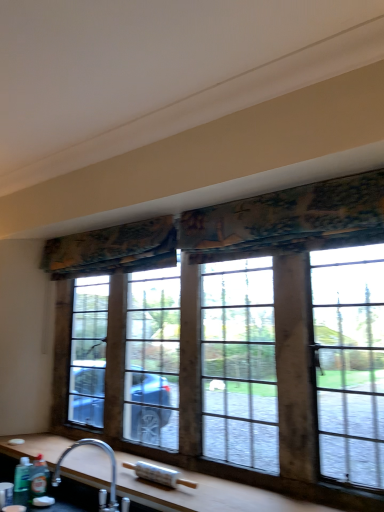
This screenshot has height=512, width=384. Describe the element at coordinates (22, 482) in the screenshot. I see `translucent plastic bottle at lower left, the first bottle viewed from the left` at that location.

In order to face green matte bottle at lower left, the second bottle from the left, should I rotate leftwards or rightwards?

Turn left by 19.917 degrees to look at green matte bottle at lower left, the second bottle from the left.

The height and width of the screenshot is (512, 384). What do you see at coordinates (113, 249) in the screenshot? I see `textured fabric curtain at upper center, arranged as the first curtain when viewed from the left` at bounding box center [113, 249].

This screenshot has height=512, width=384. I want to click on textured floral fabric at upper center, placed as the second curtain when sorted from back to front, so click(231, 229).

Find the location of `wooden at lower center`. wooden at lower center is located at coordinates (205, 494).

The height and width of the screenshot is (512, 384). Identify the location of wooden-framed window at center. (242, 240).

I want to click on translucent plastic bottle at lower left, the first bottle viewed from the left, so pos(22,482).

Between translucent plastic bottle at lower left, marked as the 2th bottle in a right-to-left arrangement, and wooden-framed window at center, which one has smaller size?

Smaller between the two is translucent plastic bottle at lower left, marked as the 2th bottle in a right-to-left arrangement.

Is translucent plastic bottle at lower left, the first bottle viewed from the left, to the left of wooden-framed window at center from the viewer's perspective?

Yes.

In the scene shown: Which is correct: translucent plastic bottle at lower left, the first bottle viewed from the left, is inside wooden-framed window at center, or outside of it?

translucent plastic bottle at lower left, the first bottle viewed from the left, cannot be found inside wooden-framed window at center.

How many degrees apart are the facing directions of translucent plastic bottle at lower left, the first bottle viewed from the left, and wooden-framed window at center?

They differ by 1.12 degrees in their facing directions.

From the image's perspective, is textured fabric curtain at upper center, the first curtain when ordered from back to front, located beneath textured floral fabric at upper center, placed as the second curtain when sorted from left to right?

Yes.

Is textured floral fabric at upper center, placed as the first curtain when sorted from front to back, a part of textured fabric curtain at upper center, which appears as the second curtain when viewed from the right?

Definitely not — textured floral fabric at upper center, placed as the first curtain when sorted from front to back, is not inside textured fabric curtain at upper center, which appears as the second curtain when viewed from the right.

Could you measure the distance between textured fabric curtain at upper center, positioned as the 2th curtain in front-to-back order, and textured floral fabric at upper center, placed as the second curtain when sorted from back to front?

textured fabric curtain at upper center, positioned as the 2th curtain in front-to-back order, is 16.40 centimeters away from textured floral fabric at upper center, placed as the second curtain when sorted from back to front.

Between textured fabric curtain at upper center, the first curtain when ordered from back to front, and textured floral fabric at upper center, placed as the second curtain when sorted from left to right, which one appears on the left side from the viewer's perspective?

From the viewer's perspective, textured fabric curtain at upper center, the first curtain when ordered from back to front, appears more on the left side.

Is textured floral fabric at upper center, placed as the second curtain when sorted from back to front, completely or partially outside of translucent plastic bottle at lower left, the first bottle viewed from the left?

textured floral fabric at upper center, placed as the second curtain when sorted from back to front, is positioned outside translucent plastic bottle at lower left, the first bottle viewed from the left.

From a real-world perspective, which is physically below, textured floral fabric at upper center, placed as the first curtain when sorted from front to back, or translucent plastic bottle at lower left, marked as the 2th bottle in a right-to-left arrangement?

translucent plastic bottle at lower left, marked as the 2th bottle in a right-to-left arrangement, from a real-world perspective.

From the picture: How far apart are translucent plastic bottle at lower left, the first bottle viewed from the left, and wooden at lower center?

A distance of 15.70 inches exists between translucent plastic bottle at lower left, the first bottle viewed from the left, and wooden at lower center.

In terms of size, does translucent plastic bottle at lower left, marked as the 2th bottle in a right-to-left arrangement, appear bigger or smaller than wooden at lower center?

translucent plastic bottle at lower left, marked as the 2th bottle in a right-to-left arrangement, is smaller than wooden at lower center.

Could you tell me if translucent plastic bottle at lower left, marked as the 2th bottle in a right-to-left arrangement, is facing wooden at lower center?

No.

Considering the points (26, 460) and (89, 449), which point is behind, point (26, 460) or point (89, 449)?

The point (89, 449) is farther from the camera.

Between textured floral fabric at upper center, the first curtain positioned from the right, and wooden-framed window at center, which one appears on the left side from the viewer's perspective?

From the viewer's perspective, wooden-framed window at center appears more on the left side.

Does textured floral fabric at upper center, placed as the second curtain when sorted from back to front, have a greater width compared to wooden-framed window at center?

Yes.

From the image's perspective, which one is positioned higher, textured floral fabric at upper center, placed as the second curtain when sorted from back to front, or wooden-framed window at center?

textured floral fabric at upper center, placed as the second curtain when sorted from back to front, is shown above in the image.

Between textured floral fabric at upper center, placed as the first curtain when sorted from front to back, and wooden-framed window at center, which one has larger size?

Bigger between the two is wooden-framed window at center.

From the textured fabric curtain at upper center, the first curtain when ordered from back to front, count the 1st bottle to the left and point to it. Please provide its 2D coordinates.

[(38, 478)]

Considering the relative positions of green matte bottle at lower left, the second bottle from the left, and textured fabric curtain at upper center, which appears as the second curtain when viewed from the right, in the image provided, is green matte bottle at lower left, the second bottle from the left, behind textured fabric curtain at upper center, which appears as the second curtain when viewed from the right,?

No, green matte bottle at lower left, the second bottle from the left, is closer to the camera.

From a real-world perspective, is green matte bottle at lower left, the 1th bottle positioned from the right, under textured fabric curtain at upper center, arranged as the first curtain when viewed from the left?

Yes, from a real-world perspective, green matte bottle at lower left, the 1th bottle positioned from the right, is under textured fabric curtain at upper center, arranged as the first curtain when viewed from the left.

Is wooden-framed window at center oriented away from textured fabric curtain at upper center, arranged as the first curtain when viewed from the left?

Correct, wooden-framed window at center is looking away from textured fabric curtain at upper center, arranged as the first curtain when viewed from the left.

Consider the image. Is wooden-framed window at center completely or partially outside of textured fabric curtain at upper center, the first curtain when ordered from back to front?

Yes, wooden-framed window at center is not within textured fabric curtain at upper center, the first curtain when ordered from back to front.

Would you say wooden-framed window at center is to the left or to the right of textured fabric curtain at upper center, the first curtain when ordered from back to front, in the picture?

In the image, wooden-framed window at center appears on the right side of textured fabric curtain at upper center, the first curtain when ordered from back to front.

From a real-world perspective, is wooden-framed window at center positioned above or below textured fabric curtain at upper center, the first curtain when ordered from back to front?

wooden-framed window at center is situated lower than textured fabric curtain at upper center, the first curtain when ordered from back to front, in the real world.

I want to click on window lying above the translucent plastic bottle at lower left, the first bottle viewed from the left (from the image's perspective), so click(242, 240).

You are a GUI agent. You are given a task and a screenshot of the screen. Output one action in this format:
    pyautogui.click(x=<x>, y=<y>)
    Task: Click on the curtain in front of the textured fabric curtain at upper center, positioned as the 2th curtain in front-to-back order
    Image resolution: width=384 pixels, height=512 pixels.
    Given the screenshot: What is the action you would take?
    pyautogui.click(x=231, y=229)

From the image, which object appears to be farther from wooden-framed window at center, textured floral fabric at upper center, placed as the first curtain when sorted from front to back, or silver metallic faucet at lower left?

Among the two, silver metallic faucet at lower left is located further to wooden-framed window at center.

When comparing their distances from textured fabric curtain at upper center, which appears as the second curtain when viewed from the right, does translucent plastic bottle at lower left, the first bottle viewed from the left, or wooden-framed window at center seem further?

translucent plastic bottle at lower left, the first bottle viewed from the left, is further to textured fabric curtain at upper center, which appears as the second curtain when viewed from the right.

Based on their spatial positions, is translucent plastic bottle at lower left, the first bottle viewed from the left, or wooden at lower center further from wooden-framed window at center?

The object further to wooden-framed window at center is translucent plastic bottle at lower left, the first bottle viewed from the left.

Which object lies further to the anchor point silver metallic faucet at lower left, wooden at lower center or wooden-framed window at center?

wooden-framed window at center.

When comparing their distances from wooden at lower center, does silver metallic faucet at lower left or green matte bottle at lower left, the second bottle from the left, seem closer?

silver metallic faucet at lower left.

Estimate the real-world distances between objects in this image. Which object is further from translucent plastic bottle at lower left, marked as the 2th bottle in a right-to-left arrangement, green matte bottle at lower left, the 1th bottle positioned from the right, or textured fabric curtain at upper center, arranged as the first curtain when viewed from the left?

textured fabric curtain at upper center, arranged as the first curtain when viewed from the left, lies further to translucent plastic bottle at lower left, marked as the 2th bottle in a right-to-left arrangement, than the other object.

Estimate the real-world distances between objects in this image. Which object is further from wooden at lower center, silver metallic faucet at lower left or textured fabric curtain at upper center, arranged as the first curtain when viewed from the left?

textured fabric curtain at upper center, arranged as the first curtain when viewed from the left, is further to wooden at lower center.

Based on their spatial positions, is translucent plastic bottle at lower left, the first bottle viewed from the left, or wooden-framed window at center closer to green matte bottle at lower left, the second bottle from the left?

translucent plastic bottle at lower left, the first bottle viewed from the left, lies closer to green matte bottle at lower left, the second bottle from the left, than the other object.

In order to click on tap between textured fabric curtain at upper center, arranged as the first curtain when viewed from the left, and wooden at lower center from top to bottom in this screenshot , I will do click(100, 489).

I want to click on window between textured floral fabric at upper center, placed as the second curtain when sorted from back to front, and silver metallic faucet at lower left in the up-down direction, so click(x=242, y=240).

Image resolution: width=384 pixels, height=512 pixels. What are the coordinates of `bottle that lies between textured fabric curtain at upper center, which appears as the second curtain when viewed from the right, and translucent plastic bottle at lower left, the first bottle viewed from the left, from top to bottom` in the screenshot? It's located at (38, 478).

At what (x,y) coordinates should I click in order to perform the action: click on bottle located between silver metallic faucet at lower left and translucent plastic bottle at lower left, marked as the 2th bottle in a right-to-left arrangement, in the depth direction. Please return your answer as a coordinate pair (x, y). The image size is (384, 512). Looking at the image, I should click on (38, 478).